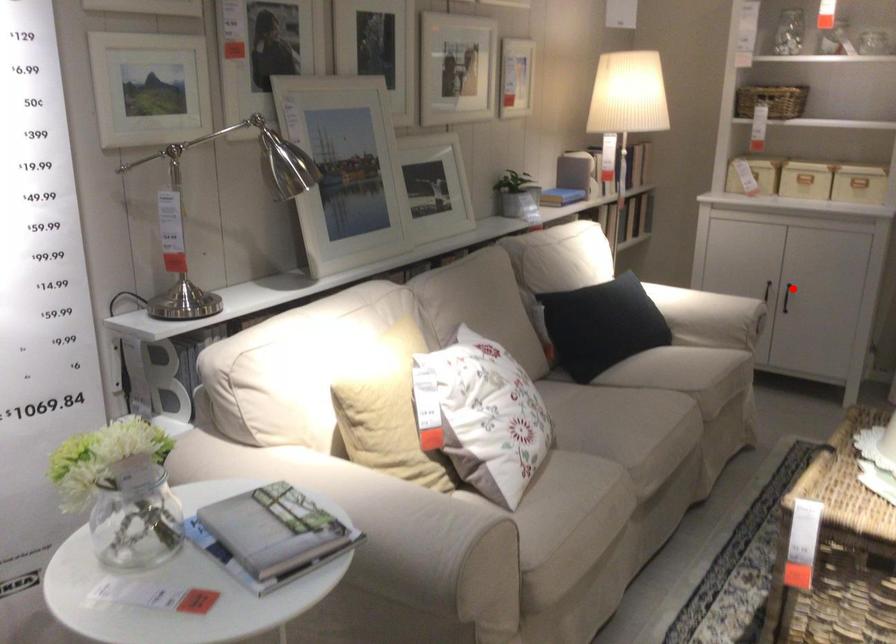
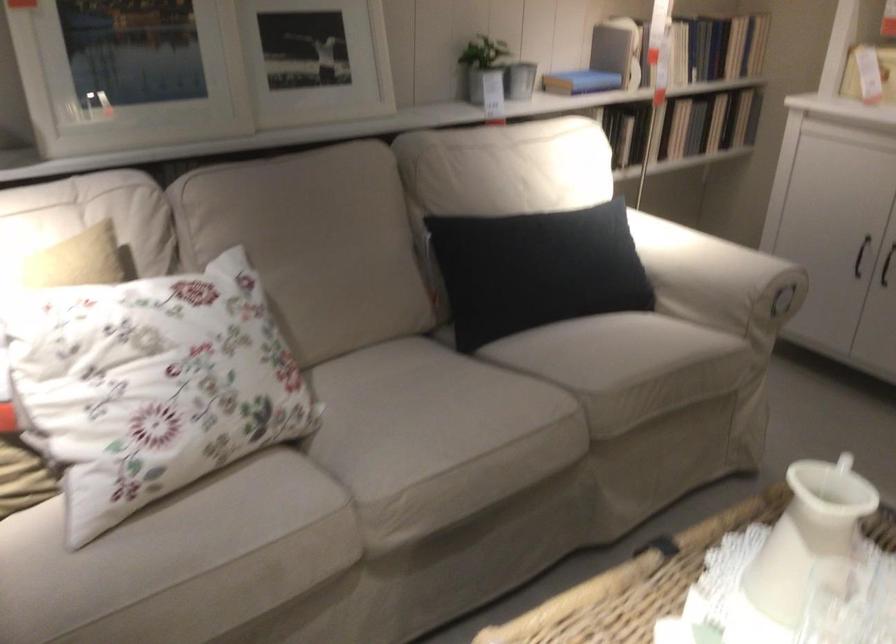
Find the pixel in the second image that matches the highlighted location in the first image.

(886, 265)